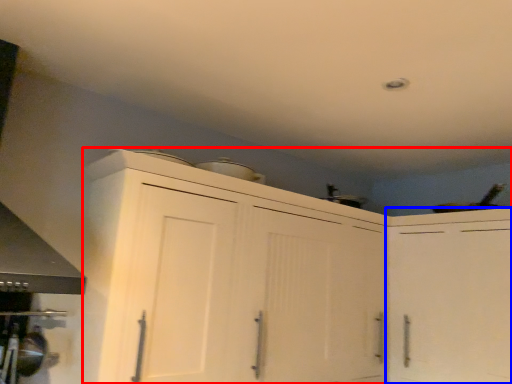
Question: Among these objects, which one is farthest to the camera, cabinetry (highlighted by a red box) or cabinetry (highlighted by a blue box)?

Choices:
 (A) cabinetry
 (B) cabinetry

Answer: (B)